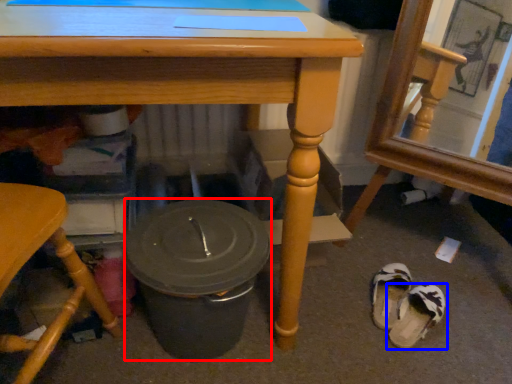
Question: Which of the following is the farthest to the observer, crock pot (highlighted by a red box) or footwear (highlighted by a blue box)?

Choices:
 (A) crock pot
 (B) footwear

Answer: (B)